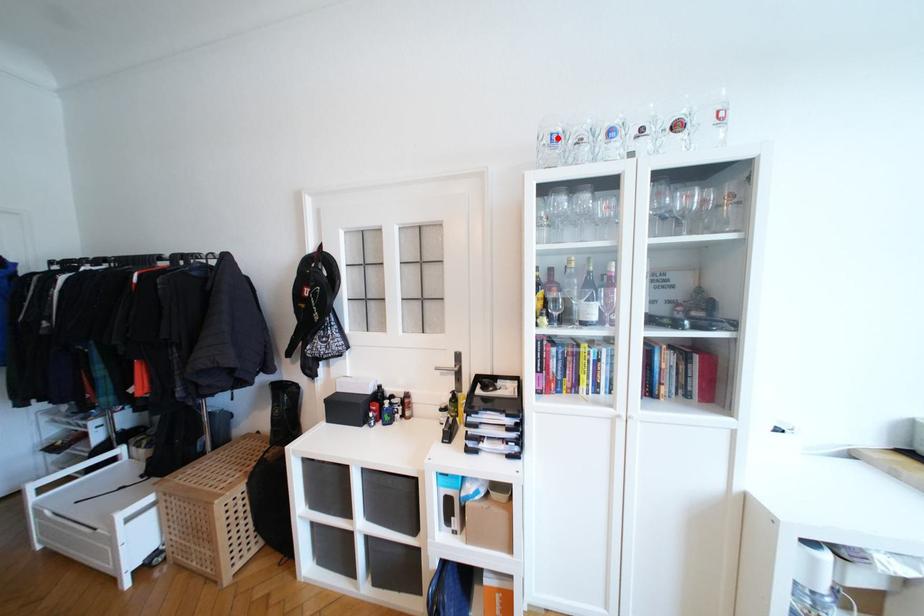
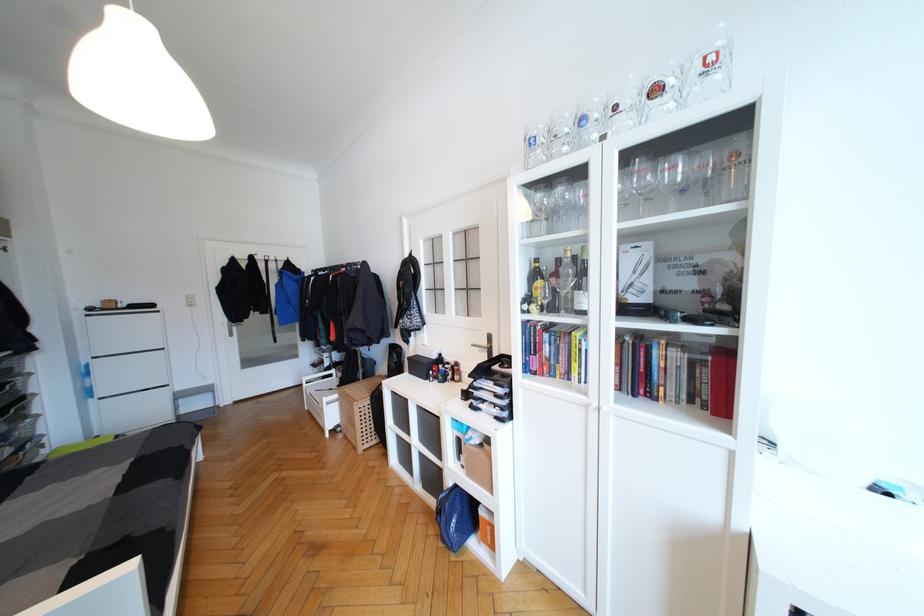
The point at the highlighted location is marked in the first image. Where is the corresponding point in the second image?

(536, 142)